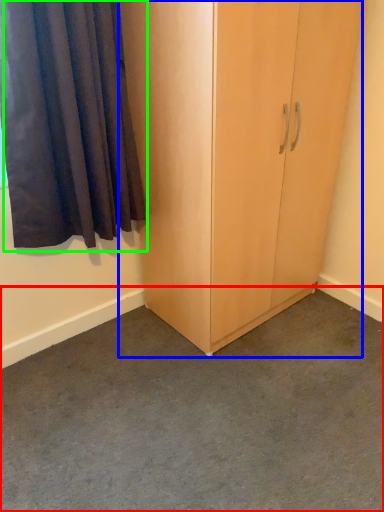
Question: Based on their relative distances, which object is nearer to concrete (highlighted by a red box)? Choose from cupboard (highlighted by a blue box) and curtain (highlighted by a green box).

Choices:
 (A) cupboard
 (B) curtain

Answer: (A)